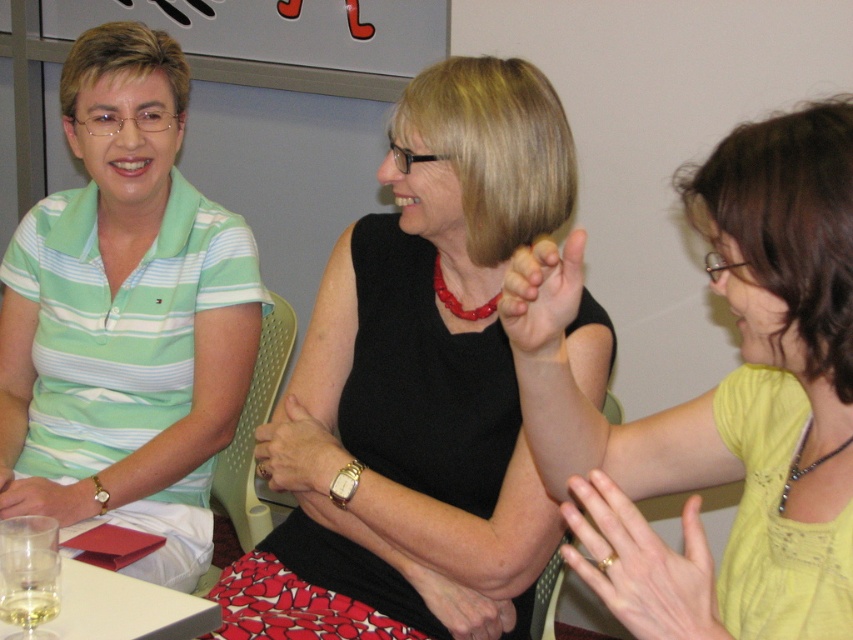
You are a photographer standing at the camera position. You want to place a small decoration on the table so that it is exactly 1 meter away from the point labeled as point (697, 602). Is this possible?

The point labeled as point (697, 602) is 81.13 centimeters away from the camera. Since 81.13 cm plus 1 meter would exceed the table length, it might not be possible unless the table is large enough. However, without knowing the table dimensions, we can only confirm the distance from the camera. Therefore, it is uncertain if placing the decoration 1 meter away from that point is feasible.

You are designing a seating arrangement for a dinner party and need to place two name tags on the table. The name tags must be placed directly in front of each person. Given the positions of the yellow matte shirt at upper right and the green striped polo shirt at left, which name tag should be placed closer to the center of the table?

The name tag for the green striped polo shirt at left should be placed closer to the center of the table because the yellow matte shirt at upper right has a smaller size compared to the green striped polo shirt at left, implying it is farther away from the center.